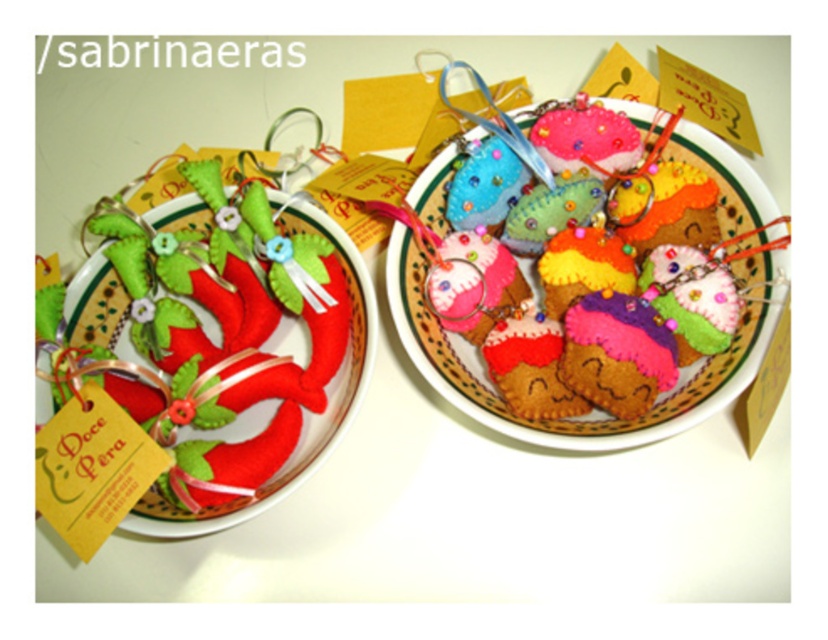
You are a guest at a Brazilian dessert party and want to choose a dessert that is larger in size. Which one should you pick between the multicolored felt hearts at center and the matte felt paper plate at left?

The multicolored felt hearts at center has a larger size compared to the matte felt paper plate at left, so you should pick the multicolored felt hearts at center.

You are at a Brazilian cultural fair and see the multicolored felt hearts at center and the matte felt paper plate at left. Which object is nearer to you?

The multicolored felt hearts at center is closer to the viewer than the matte felt paper plate at left.

You are arranging a Brazilian dessert display and need to place the multicolored felt hearts at center and the matte felt paper plate at left. According to the image, which object is located to the right of the other?

The multicolored felt hearts at center is positioned on the right side of matte felt paper plate at left.